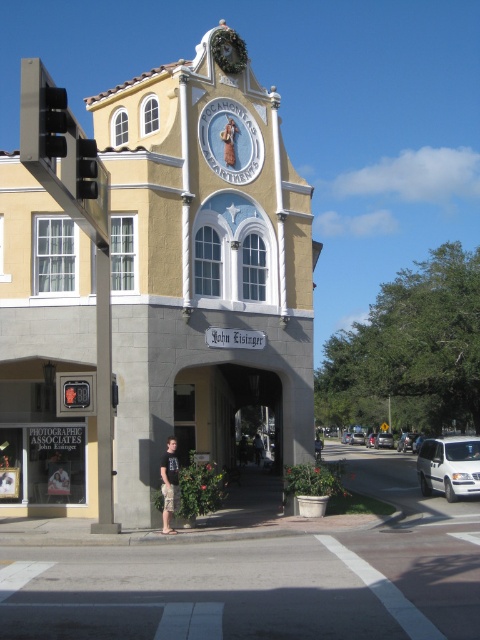
You are standing in front of the Pocahontas Apartments and notice a black cotton shirt at center and a silver metallic sedan at center. Which object is closer to you?

The black cotton shirt at center is closer because it is positioned over the silver metallic sedan at center.

You are standing in front of the Pocahontas Apartments and want to take a photo of the building. You notice two points on the building at coordinates point (355, 442) and point (319, 448). Which point will appear closer to the top of your camera frame?

Point (355, 442) is further to the camera than point (319, 448), so it will appear closer to the top of the camera frame.

You are standing in front of the Pocahontas Apartments and need to park your car. You see a silver metallic sedan at center and brown textured shorts at lower center. Which object is closer to the entrance of the building?

The brown textured shorts at lower center is closer to the entrance of the Pocahontas Apartments because the silver metallic sedan at center is positioned to its right side, meaning the sedan is further away from the entrance compared to the shorts.